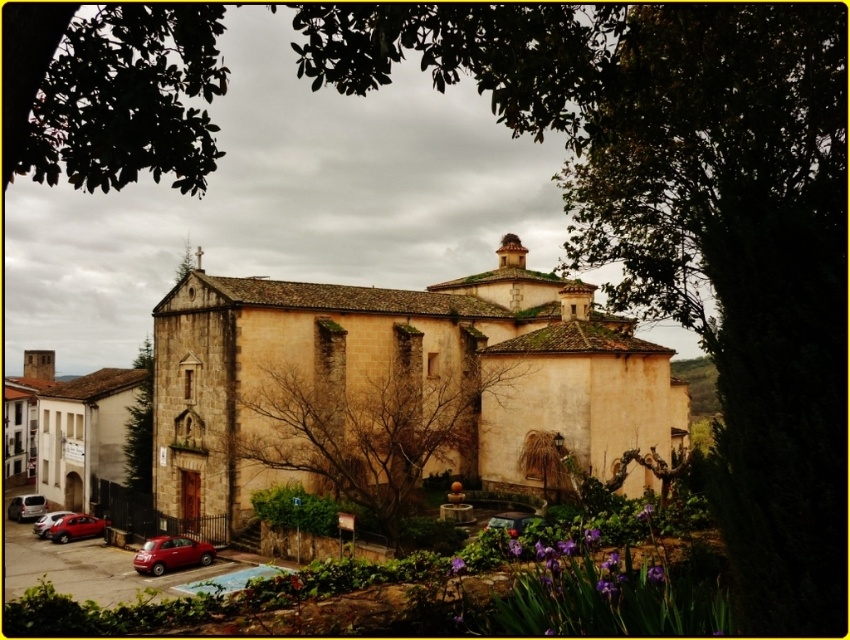
Question: Considering the real-world distances, which object is farthest from the shiny red car at lower left?

Choices:
 (A) green textured tree at left
 (B) metallic silver car at lower left
 (C) beige stone church at center

Answer: (B)

Question: Which object is the closest to the green textured tree at left?

Choices:
 (A) brown textured tree at center
 (B) shiny red car at lower left
 (C) matte red car at lower left
 (D) metallic silver car at lower left

Answer: (C)

Question: Is beige stone church at center to the right of shiny red car at lower left from the viewer's perspective?

Choices:
 (A) yes
 (B) no

Answer: (A)

Question: Does metallic silver car at lower left have a smaller size compared to matte red car at lower left?

Choices:
 (A) yes
 (B) no

Answer: (A)

Question: Is the position of green textured tree at left less distant than that of metallic silver car at lower left?

Choices:
 (A) no
 (B) yes

Answer: (B)

Question: Which of the following is the closest to the observer?

Choices:
 (A) green textured tree at left
 (B) metallic red car at lower left

Answer: (B)